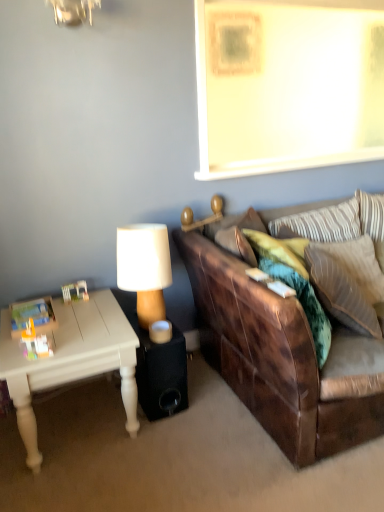
At what (x,y) coordinates should I click in order to perform the action: click on free region on the left part of black fabric speaker at lower center. Please return your answer as a coordinate pair (x, y). Image resolution: width=384 pixels, height=512 pixels. Looking at the image, I should click on (99, 406).